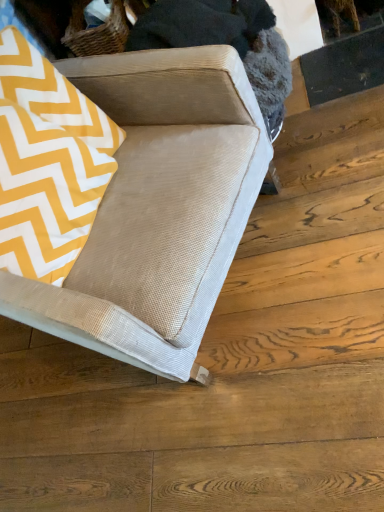
Question: Would you say beige corduroy couch at center is to the left or to the right of yellow zigzag fabric at upper left in the picture?

Choices:
 (A) right
 (B) left

Answer: (A)

Question: From a real-world perspective, is beige corduroy couch at center positioned above or below yellow zigzag fabric at upper left?

Choices:
 (A) above
 (B) below

Answer: (B)

Question: Considering their positions, is beige corduroy couch at center located in front of or behind yellow zigzag fabric at upper left?

Choices:
 (A) front
 (B) behind

Answer: (A)

Question: Which is correct: yellow zigzag fabric at upper left is inside beige corduroy couch at center, or outside of it?

Choices:
 (A) outside
 (B) inside

Answer: (B)

Question: Is point (29, 221) positioned closer to the camera than point (142, 226)?

Choices:
 (A) closer
 (B) farther

Answer: (A)

Question: Visually, is yellow zigzag fabric at upper left positioned to the left or to the right of beige corduroy couch at center?

Choices:
 (A) left
 (B) right

Answer: (A)

Question: In the image, is yellow zigzag fabric at upper left positioned in front of or behind beige corduroy couch at center?

Choices:
 (A) behind
 (B) front

Answer: (A)